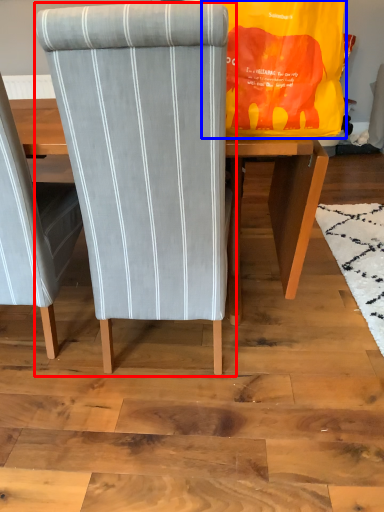
Question: Which object is closer to the camera taking this photo, chair (highlighted by a red box) or bag (highlighted by a blue box)?

Choices:
 (A) chair
 (B) bag

Answer: (A)